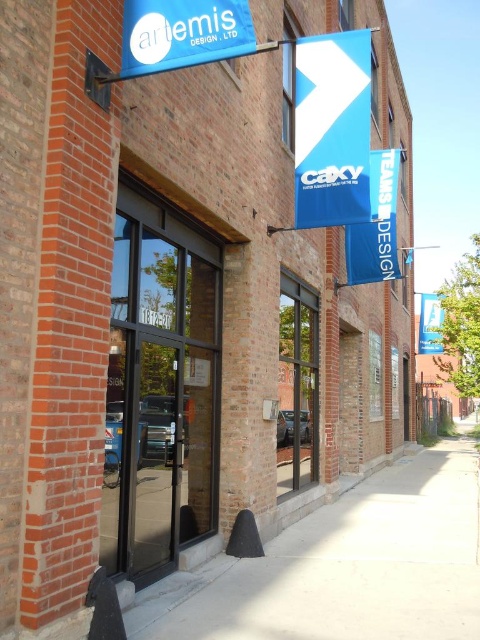
You are standing on the smooth concrete sidewalk at center and want to see the blue matte sign at upper center. Since the sidewalk is taller than the sign, will you have to look up or down to see it?

The smooth concrete sidewalk at center is taller than blue matte sign at upper center, so you will have to look down to see it.